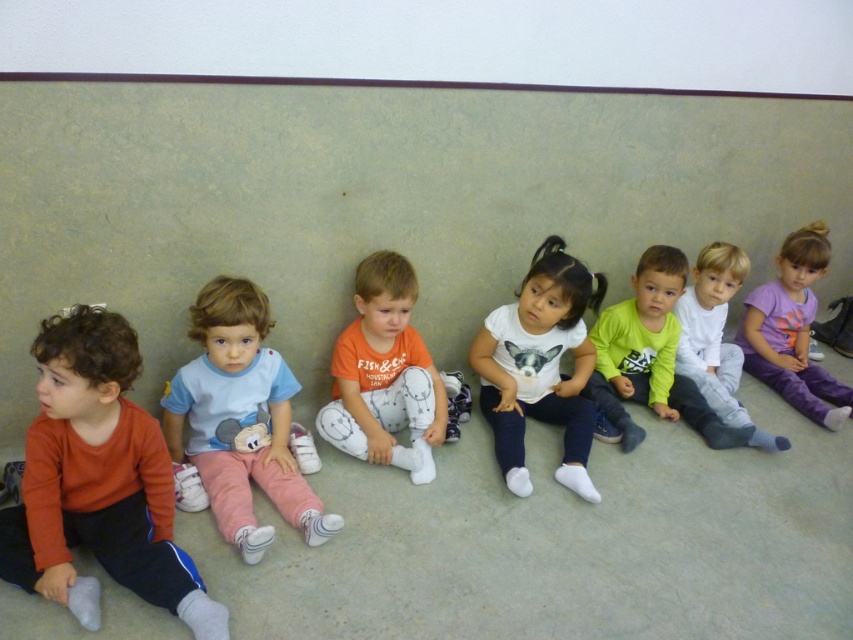
Who is positioned more to the left, light blue cotton shirt at center or purple cotton shirt at right?

From the viewer's perspective, light blue cotton shirt at center appears more on the left side.

Is light blue cotton shirt at center taller than purple cotton shirt at right?

No.

Who is more forward, (x=259, y=381) or (x=759, y=346)?

Positioned in front is point (x=259, y=381).

The image size is (853, 640). Find the location of `light blue cotton shirt at center`. light blue cotton shirt at center is located at coordinates (241, 419).

Between white matte shirt at center and purple cotton shirt at right, which one is positioned higher?

purple cotton shirt at right

Where is `white matte shirt at center`? white matte shirt at center is located at coordinates (540, 365).

Does matte orange shirt at left have a lesser height compared to purple cotton shirt at right?

Correct, matte orange shirt at left is not as tall as purple cotton shirt at right.

Who is positioned more to the right, matte orange shirt at left or purple cotton shirt at right?

purple cotton shirt at right is more to the right.

Where is `matte orange shirt at left`? The width and height of the screenshot is (853, 640). matte orange shirt at left is located at coordinates (97, 481).